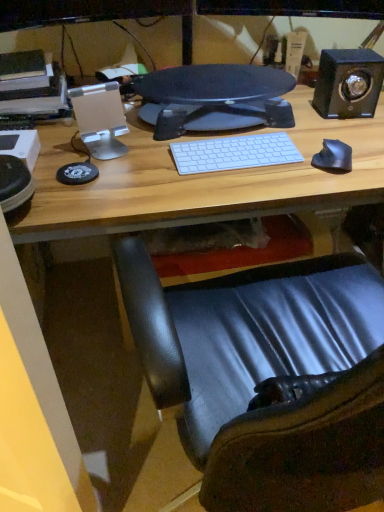
At what (x,y) coordinates should I click in order to perform the action: click on black textured monitor at center. Please return your answer as a coordinate pair (x, y). This screenshot has height=512, width=384. Looking at the image, I should click on (218, 95).

Between black textured monitor at center and black matte speaker at upper right, which one appears on the left side from the viewer's perspective?

From the viewer's perspective, black textured monitor at center appears more on the left side.

Does black textured monitor at center have a greater width compared to black matte speaker at upper right?

Indeed, black textured monitor at center has a greater width compared to black matte speaker at upper right.

Which is behind, black textured monitor at center or black matte speaker at upper right?

Positioned behind is black matte speaker at upper right.

Which of these two, black textured monitor at center or black matte speaker at upper right, stands shorter?

With less height is black textured monitor at center.

Between point (338, 170) and point (226, 88), which one is positioned in front?

The point (338, 170) is in front.

Is black textured monitor at center surrounded by shiny black mouse at right?

No, black textured monitor at center is not a part of shiny black mouse at right.

Which object is further away from the camera, shiny black mouse at right or black textured monitor at center?

black textured monitor at center is behind.

Is black textured monitor at center spatially inside shiny black mouse at right, or outside of it?

black textured monitor at center cannot be found inside shiny black mouse at right.

Is black textured monitor at center taller or shorter than shiny black mouse at right?

black textured monitor at center is taller than shiny black mouse at right.

Considering the relative sizes of black textured monitor at center and shiny black mouse at right in the image provided, is black textured monitor at center bigger than shiny black mouse at right?

Correct, black textured monitor at center is larger in size than shiny black mouse at right.

How many degrees apart are the facing directions of shiny black mouse at right and white matte keyboard at center?

The angular difference between shiny black mouse at right and white matte keyboard at center is 23.9 degrees.

From the image's perspective, is shiny black mouse at right above or below white matte keyboard at center?

Based on their image positions, shiny black mouse at right is located beneath white matte keyboard at center.

Is shiny black mouse at right behind white matte keyboard at center?

No, it is in front of white matte keyboard at center.

Is white matte keyboard at center inside shiny black mouse at right?

No, white matte keyboard at center is not surrounded by shiny black mouse at right.

Is the depth of shiny black mouse at right less than that of black matte speaker at upper right?

Yes, shiny black mouse at right is closer to the viewer.

How far apart are shiny black mouse at right and black matte speaker at upper right?

shiny black mouse at right is 10.79 inches from black matte speaker at upper right.

Would you say shiny black mouse at right is to the left or to the right of black matte speaker at upper right in the picture?

Clearly, shiny black mouse at right is on the left of black matte speaker at upper right in the image.

Is black matte speaker at upper right at the back of shiny black mouse at right?

Yes, shiny black mouse at right is positioned with its back facing black matte speaker at upper right.

Are black matte speaker at upper right and white matte keyboard at center far apart?

No, black matte speaker at upper right is not far away from white matte keyboard at center.

Consider the image. Between black matte speaker at upper right and white matte keyboard at center, which one has more height?

Standing taller between the two is black matte speaker at upper right.

In the scene shown: In terms of width, does black matte speaker at upper right look wider or thinner when compared to white matte keyboard at center?

black matte speaker at upper right is wider than white matte keyboard at center.

Looking at this image, is white matte keyboard at center next to shiny black mouse at right?

No, white matte keyboard at center is not making contact with shiny black mouse at right.

Can you confirm if white matte keyboard at center is wider than shiny black mouse at right?

Yes.

Between point (267, 159) and point (334, 158), which one is positioned behind?

The point (267, 159) is farther.

Is shiny black mouse at right completely or partially inside white matte keyboard at center?

That's incorrect, shiny black mouse at right is not inside white matte keyboard at center.

Where is `computer monitor that appears in front of the black matte speaker at upper right`? computer monitor that appears in front of the black matte speaker at upper right is located at coordinates (218, 95).

Identify the location of computer monitor that is on the left side of shiny black mouse at right. (x=218, y=95).

When comparing their distances from black matte speaker at upper right, does shiny black mouse at right or black textured monitor at center seem closer?

black textured monitor at center.

Consider the image. Estimate the real-world distances between objects in this image. Which object is further from black textured monitor at center, shiny black mouse at right or white matte keyboard at center?

The object further to black textured monitor at center is shiny black mouse at right.

Looking at the image, which one is located closer to black matte speaker at upper right, white matte keyboard at center or shiny black mouse at right?

Among the two, shiny black mouse at right is located nearer to black matte speaker at upper right.

From the image, which object appears to be farther from black matte speaker at upper right, black textured monitor at center or shiny black mouse at right?

shiny black mouse at right.

Considering their positions, is black textured monitor at center positioned further to shiny black mouse at right than black matte speaker at upper right?

black textured monitor at center lies further to shiny black mouse at right than the other object.

Looking at the image, which one is located further to black textured monitor at center, black matte speaker at upper right or shiny black mouse at right?

shiny black mouse at right is positioned further to the anchor black textured monitor at center.

Considering their positions, is black textured monitor at center positioned further to shiny black mouse at right than white matte keyboard at center?

Based on the image, black textured monitor at center appears to be further to shiny black mouse at right.

From the image, which object appears to be farther from white matte keyboard at center, shiny black mouse at right or black matte speaker at upper right?

black matte speaker at upper right is further to white matte keyboard at center.

Find the location of a particular element. computer keyboard between black textured monitor at center and shiny black mouse at right in the horizontal direction is located at coordinates (234, 153).

The height and width of the screenshot is (512, 384). In order to click on mouse situated between black textured monitor at center and black matte speaker at upper right from left to right in this screenshot , I will do `click(333, 157)`.

Locate an element on the screen. mouse situated between white matte keyboard at center and black matte speaker at upper right from left to right is located at coordinates (333, 157).

At what (x,y) coordinates should I click in order to perform the action: click on computer keyboard between black textured monitor at center and black matte speaker at upper right from left to right. Please return your answer as a coordinate pair (x, y). The width and height of the screenshot is (384, 512). Looking at the image, I should click on (234, 153).